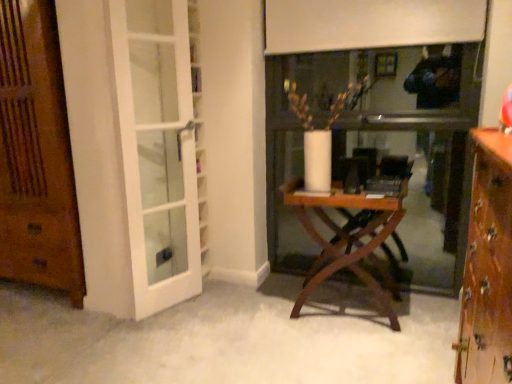
Where is `empty space that is in between wooden folding table at center and white glass door at left`? This screenshot has height=384, width=512. empty space that is in between wooden folding table at center and white glass door at left is located at coordinates (244, 309).